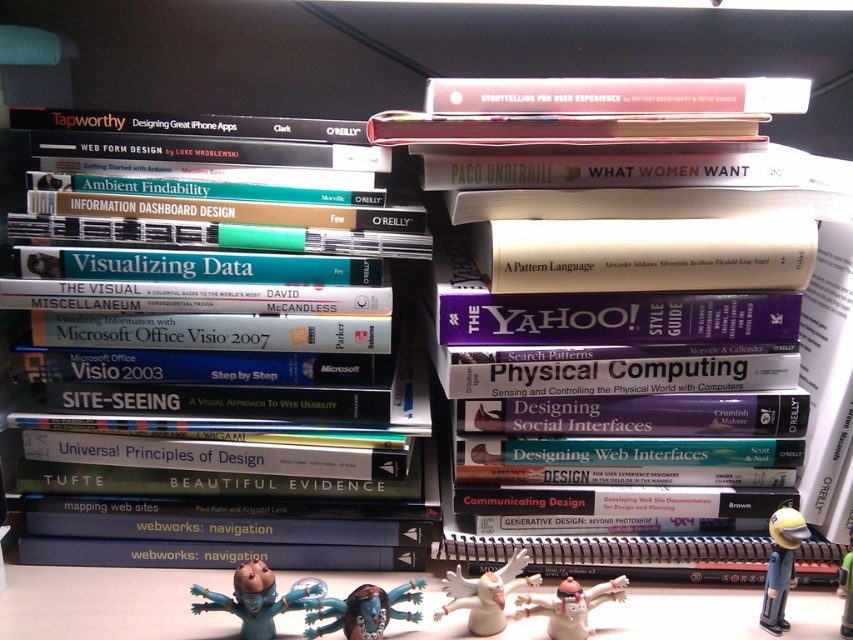
Who is more distant from viewer, (456,109) or (550,602)?

The point (456,109) is more distant.

Is point (799, 109) positioned before point (570, 621)?

No, it is not.

Which is in front, point (694, 77) or point (548, 598)?

Point (548, 598) is more forward.

Locate an element on the screen. matte pink book at upper center is located at coordinates (616, 97).

Which of these two, teal matte figurine at lower center or white matte angel at center, stands shorter?

white matte angel at center

Where is `teal matte figurine at lower center`? The width and height of the screenshot is (853, 640). teal matte figurine at lower center is located at coordinates (256, 598).

Consider the image. Does matte pink book at upper center appear under shiny blue plastic toy at center?

Incorrect, matte pink book at upper center is not positioned below shiny blue plastic toy at center.

Is matte pink book at upper center smaller than shiny blue plastic toy at center?

Incorrect, matte pink book at upper center is not smaller in size than shiny blue plastic toy at center.

Image resolution: width=853 pixels, height=640 pixels. Describe the element at coordinates (616, 97) in the screenshot. I see `matte pink book at upper center` at that location.

What are the coordinates of `matte pink book at upper center` in the screenshot? It's located at click(616, 97).